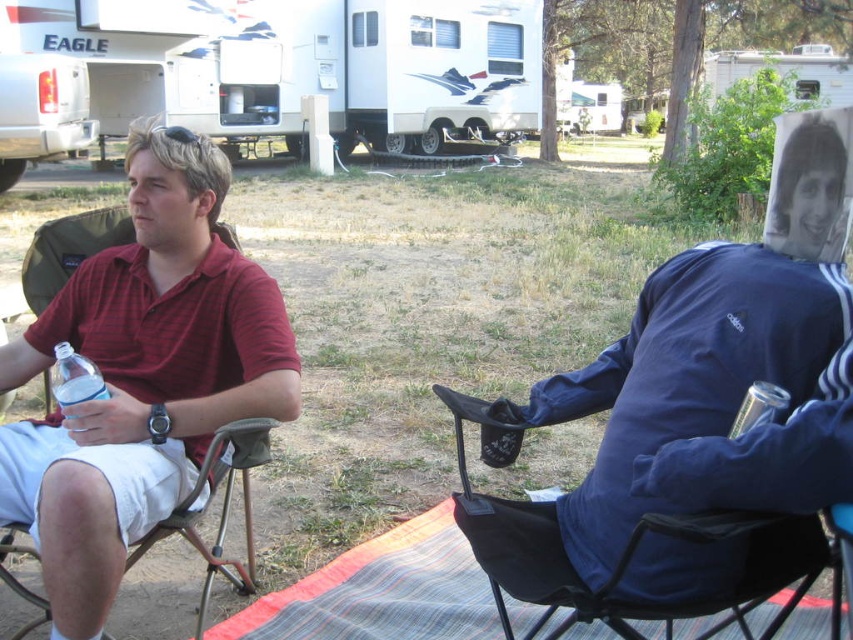
Between matte white rv at upper left and clear plastic bottle at lower left, which one appears on the right side from the viewer's perspective?

Positioned to the right is clear plastic bottle at lower left.

Can you confirm if matte white rv at upper left is shorter than clear plastic bottle at lower left?

No, matte white rv at upper left is not shorter than clear plastic bottle at lower left.

Is point (10, 56) farther from camera compared to point (56, 342)?

Yes, point (10, 56) is behind point (56, 342).

This screenshot has width=853, height=640. Find the location of `matte white rv at upper left`. matte white rv at upper left is located at coordinates click(41, 112).

Is matte red shirt at left smaller than clear plastic bottle at lower left?

Incorrect, matte red shirt at left is not smaller in size than clear plastic bottle at lower left.

Between matte red shirt at left and clear plastic bottle at lower left, which one is positioned lower?

clear plastic bottle at lower left is below.

Image resolution: width=853 pixels, height=640 pixels. In order to click on matte red shirt at left in this screenshot , I will do `click(141, 376)`.

Between matte red shirt at left and clear plastic cup at lower right, which one has more height?

matte red shirt at left

What do you see at coordinates (141, 376) in the screenshot? This screenshot has height=640, width=853. I see `matte red shirt at left` at bounding box center [141, 376].

Identify the location of matte red shirt at left. This screenshot has width=853, height=640. (141, 376).